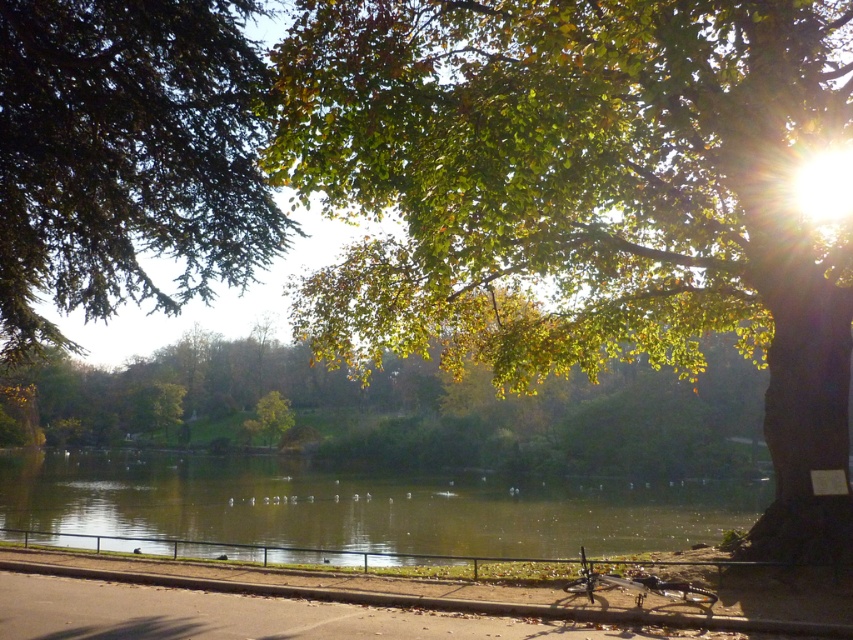
You are a park visitor who wants to take a photo of the shiny metallic bicycle at lower center without any obstructions. Are the green textured leaves at upper left blocking your view of the bicycle?

The green textured leaves at upper left are above the shiny metallic bicycle at lower center, so they might be blocking the view depending on your angle. Adjust your position to ensure the bicycle is visible without obstruction.

Based on the photo, you are a park ranger who needs to retrieve the shiny metallic bicycle at lower center from its current position. The green textured leaves at upper left mark the entrance to a restricted area. Can you safely move the bicycle without entering the restricted zone?

The distance between the green textured leaves at upper left and the shiny metallic bicycle at lower center is 10.56 meters. Since the leaves mark the entrance to the restricted area, moving the bicycle from its current position to outside the restricted zone would require keeping it beyond the 10.56 meter boundary from the leaves. However, without knowing the exact size of the restricted area, it is uncertain if this distance is sufficient to avoid entering the restricted zone. Additional information about

You are a photographer planning to capture a landscape photo that emphasizes the green leafy tree at upper right and the green reflective water at center. Based on their sizes in the image, which object should you focus on to ensure it takes up more space in your photo?

The green leafy tree at upper right is bigger than the green reflective water at center, so focusing on it will ensure it takes up more space in your photo.